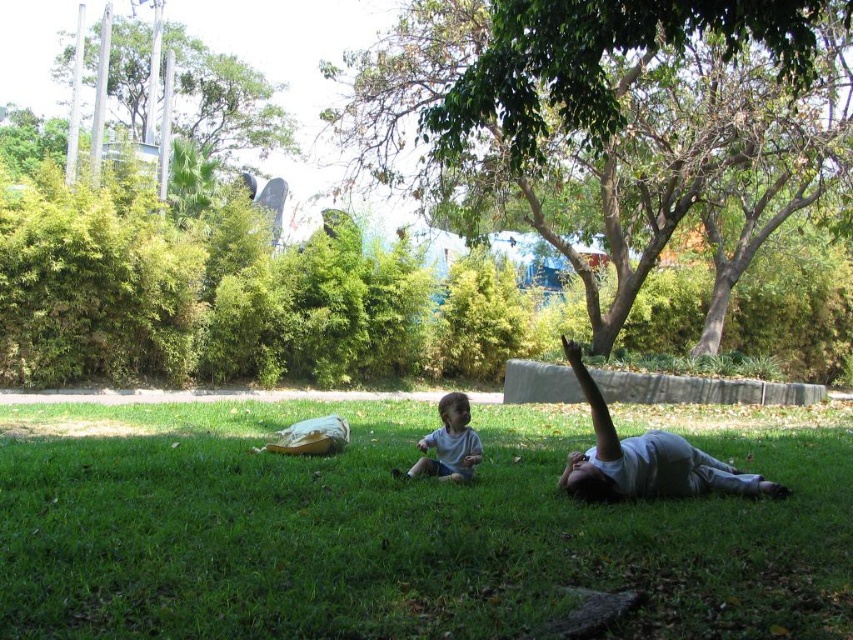
Can you confirm if green leafy tree at upper left is positioned below white cotton shirt at center?

Actually, green leafy tree at upper left is above white cotton shirt at center.

Which is below, green leafy tree at upper left or white cotton shirt at center?

white cotton shirt at center

Image resolution: width=853 pixels, height=640 pixels. Find the location of `green leafy tree at upper left`. green leafy tree at upper left is located at coordinates (221, 99).

Image resolution: width=853 pixels, height=640 pixels. What are the coordinates of `green leafy tree at upper left` in the screenshot? It's located at (221, 99).

Is green grass at center to the left of white cotton shirt at lower right from the viewer's perspective?

Yes, green grass at center is to the left of white cotton shirt at lower right.

Describe the element at coordinates (404, 528) in the screenshot. I see `green grass at center` at that location.

Where is `green grass at center`? This screenshot has height=640, width=853. green grass at center is located at coordinates (404, 528).

Where is `green grass at center`? green grass at center is located at coordinates (404, 528).

The height and width of the screenshot is (640, 853). What do you see at coordinates (221, 99) in the screenshot?
I see `green leafy tree at upper left` at bounding box center [221, 99].

Is green leafy tree at upper left to the right of white cotton shirt at lower right from the viewer's perspective?

In fact, green leafy tree at upper left is to the left of white cotton shirt at lower right.

Identify the location of green leafy tree at upper left. This screenshot has width=853, height=640. coord(221,99).